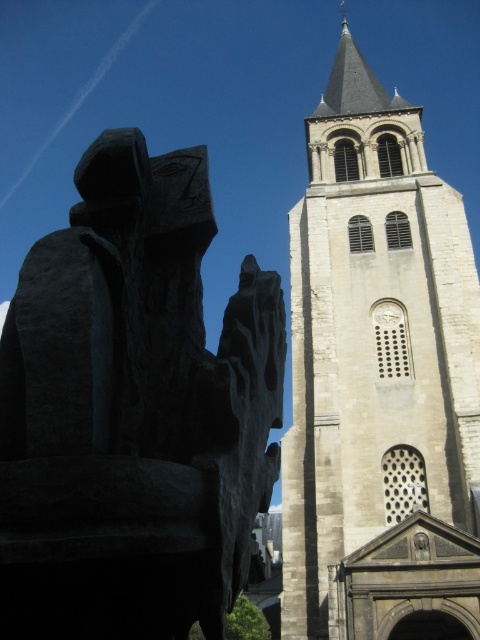
You are standing at the center of the image and want to walk towards the point marked at coordinates (132, 410). Which direction should you head to reach it?

The point at (132, 410) is located on the black stone sculpture at left, so you should head to the left to reach it.

Consider the image. You are an architect designing a new park layout. You need to place a 3m wide bench between the black stone sculpture at left and the beige stone tower at center. Can the bench fit between them without touching either structure?

The black stone sculpture at left is narrower than the beige stone tower at center. However, since the exact distance between them isn not specified, we cannot determine if the 3m wide bench can fit without more information about their separation.

You are an architect analyzing the spatial arrangement of the scene. Which object is positioned to the left of the other between the black stone sculpture at left and the beige stone tower at center?

The black stone sculpture at left is to the left of the beige stone tower at center.